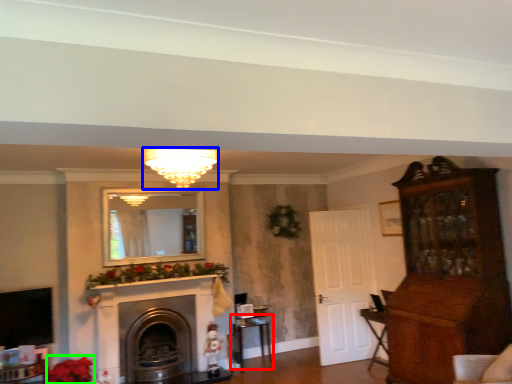
Question: Based on their relative distances, which object is farther from table (highlighted by a red box)? Choose from light fixture (highlighted by a blue box) and flower (highlighted by a green box).

Choices:
 (A) light fixture
 (B) flower

Answer: (A)